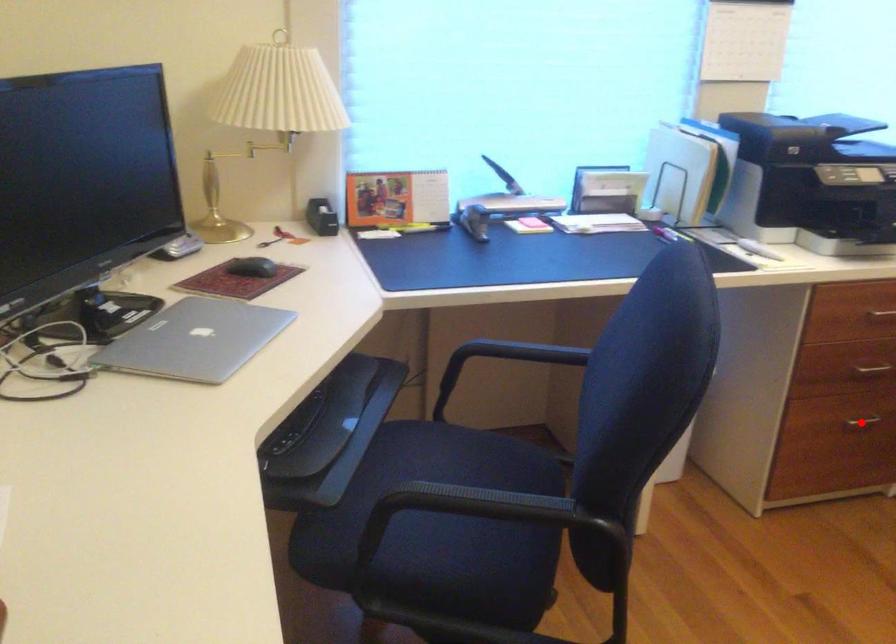
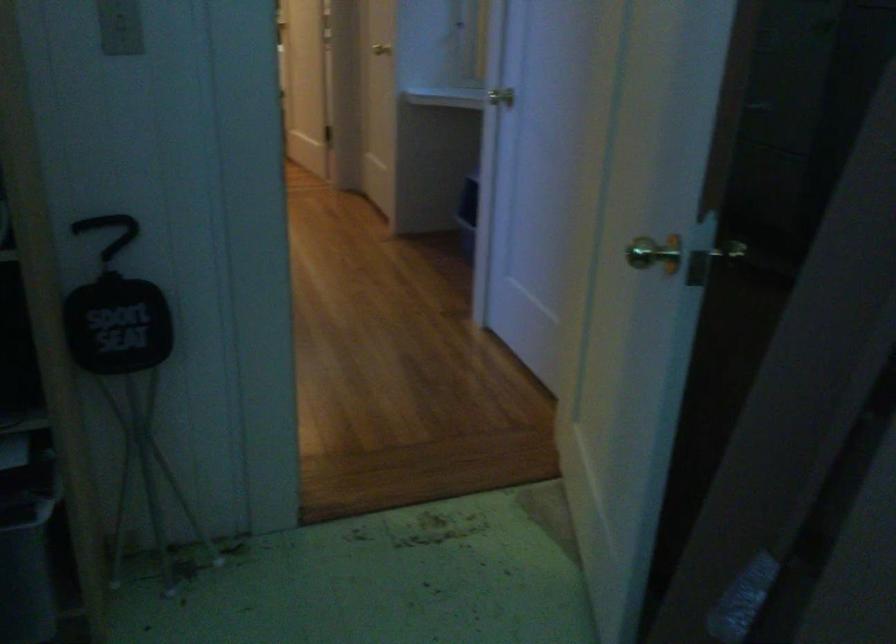
Question: I am providing you with two images of the same scene from different viewpoints. A red point is marked on the first image. Can you still see the location of the red point in image 2?

Choices:
 (A) Yes
 (B) No

Answer: (B)